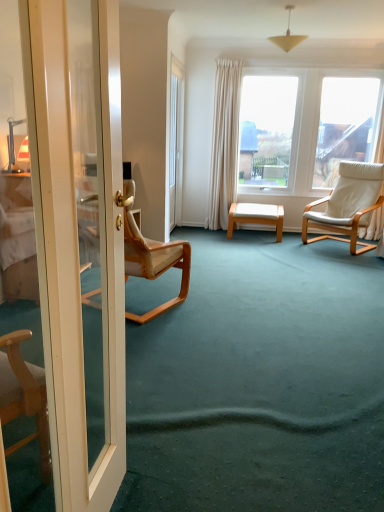
This screenshot has height=512, width=384. In order to click on transparent glass door at center in this screenshot , I will do `click(176, 142)`.

What do you see at coordinates (151, 256) in the screenshot?
I see `light beige wood chair at left, which ranks as the first chair in left-to-right order` at bounding box center [151, 256].

What do you see at coordinates (77, 244) in the screenshot? This screenshot has height=512, width=384. I see `white glossy door at left` at bounding box center [77, 244].

Locate an element on the screen. Image resolution: width=384 pixels, height=512 pixels. matte white cone at upper center is located at coordinates (288, 36).

At what (x,y) coordinates should I click in order to perform the action: click on transparent glass door at center. Please return your answer as a coordinate pair (x, y). The width and height of the screenshot is (384, 512). Looking at the image, I should click on point(176,142).

From the image's perspective, is white glossy door at left beneath white wood stool at center?

Correct, white glossy door at left appears lower than white wood stool at center in the image.

From the picture: Would you say white glossy door at left is to the left or to the right of white wood stool at center in the picture?

From the image, it's evident that white glossy door at left is to the left of white wood stool at center.

Based on the photo, is white wood stool at center located within white glossy door at left?

No, white wood stool at center is not surrounded by white glossy door at left.

From the picture: Is there a large distance between white glossy door at left and white wood stool at center?

Yes, white glossy door at left and white wood stool at center are quite far apart.

Measure the distance between white leather chair at right, which ranks as the first chair in back-to-front order, and light beige wood chair at left, the 2th chair viewed from the back.

white leather chair at right, which ranks as the first chair in back-to-front order, and light beige wood chair at left, the 2th chair viewed from the back, are 7.36 feet apart from each other.

Is white leather chair at right, which ranks as the first chair in back-to-front order, shorter than light beige wood chair at left, which is the second chair from right to left?

Yes.

Between point (366, 177) and point (98, 293), which one is positioned behind?

The point (366, 177) is more distant.

From a real-world perspective, which is physically below, white leather chair at right, the 2th chair in the front-to-back sequence, or light beige wood chair at left, arranged as the first chair when viewed from the front?

From a 3D spatial view, light beige wood chair at left, arranged as the first chair when viewed from the front, is below.

Which is closer to the camera, (127, 198) or (274, 222)?

The point (127, 198) is closer.

Which is correct: light beige wood chair at left, arranged as the first chair when viewed from the front, is inside white wood stool at center, or outside of it?

light beige wood chair at left, arranged as the first chair when viewed from the front, is located beyond the bounds of white wood stool at center.

What's the angular difference between light beige wood chair at left, arranged as the first chair when viewed from the front, and white wood stool at center's facing directions?

The angle between the facing direction of light beige wood chair at left, arranged as the first chair when viewed from the front, and the facing direction of white wood stool at center is 156 degrees.

Is light beige wood chair at left, the 2th chair viewed from the back, facing away from white wood stool at center?

light beige wood chair at left, the 2th chair viewed from the back, is not turned away from white wood stool at center.

Considering the positions of objects light beige wood chair at left, which ranks as the first chair in left-to-right order, and matte white cone at upper center in the image provided, who is more to the right, light beige wood chair at left, which ranks as the first chair in left-to-right order, or matte white cone at upper center?

matte white cone at upper center.

Is matte white cone at upper center located within light beige wood chair at left, which is the second chair from right to left?

No.

Which is closer to the camera, [143,277] or [285,50]?

Clearly, point [143,277] is closer to the camera than point [285,50].

Considering the sizes of objects light beige wood chair at left, which is the second chair from right to left, and matte white cone at upper center in the image provided, who is shorter, light beige wood chair at left, which is the second chair from right to left, or matte white cone at upper center?

With less height is matte white cone at upper center.

Consider the image. From a real-world perspective, which is physically above, light beige wood chair at left, the 2th chair viewed from the back, or white leather chair at right, which ranks as the first chair in back-to-front order?

In real-world perspective, white leather chair at right, which ranks as the first chair in back-to-front order, is above.

Considering their positions, is light beige wood chair at left, the 2th chair viewed from the back, located in front of or behind white leather chair at right, the first chair in the right-to-left sequence?

In the image, light beige wood chair at left, the 2th chair viewed from the back, appears in front of white leather chair at right, the first chair in the right-to-left sequence.

Is light beige wood chair at left, which ranks as the first chair in left-to-right order, looking in the opposite direction of white leather chair at right, the 2th chair in the front-to-back sequence?

That's not correct — light beige wood chair at left, which ranks as the first chair in left-to-right order, is not looking away from white leather chair at right, the 2th chair in the front-to-back sequence.

Does light beige wood chair at left, which ranks as the first chair in left-to-right order, appear on the right side of white leather chair at right, the first chair in the right-to-left sequence?

In fact, light beige wood chair at left, which ranks as the first chair in left-to-right order, is to the left of white leather chair at right, the first chair in the right-to-left sequence.

Can you confirm if transparent glass door at center is taller than matte white cone at upper center?

Yes.

Is transparent glass door at center beside matte white cone at upper center?

No, transparent glass door at center is not with matte white cone at upper center.

Is the depth of transparent glass door at center less than that of matte white cone at upper center?

No, it is not.

From a real-world perspective, is transparent glass door at center positioned under matte white cone at upper center based on gravity?

Yes, from a real-world perspective, transparent glass door at center is under matte white cone at upper center.

Does white leather chair at right, which ranks as the first chair in back-to-front order, have a lesser width compared to transparent glass door at center?

In fact, white leather chair at right, which ranks as the first chair in back-to-front order, might be wider than transparent glass door at center.

Does white leather chair at right, the first chair in the right-to-left sequence, have a greater height compared to transparent glass door at center?

In fact, white leather chair at right, the first chair in the right-to-left sequence, may be shorter than transparent glass door at center.

How distant is white leather chair at right, which ranks as the first chair in back-to-front order, from transparent glass door at center?

They are 7.93 feet apart.

From a real-world perspective, is white leather chair at right, which ranks as the first chair in back-to-front order, located higher than transparent glass door at center?

No, from a real-world perspective, white leather chair at right, which ranks as the first chair in back-to-front order, is not above transparent glass door at center.

Find the location of `table on the right of the white glossy door at left`. table on the right of the white glossy door at left is located at coordinates (256, 216).

At what (x,y) coordinates should I click in order to perform the action: click on chair above the light beige wood chair at left, arranged as the first chair when viewed from the front (from the image's perspective). Please return your answer as a coordinate pair (x, y). The height and width of the screenshot is (512, 384). Looking at the image, I should click on (348, 204).

Which object lies further to the anchor point white wood stool at center, white leather chair at right, which is counted as the 2th chair, starting from the left, or light beige wood chair at left, the 2th chair viewed from the back?

Based on the image, light beige wood chair at left, the 2th chair viewed from the back, appears to be further to white wood stool at center.

Based on their spatial positions, is transparent glass door at center or white glossy door at left further from white wood stool at center?

white glossy door at left lies further to white wood stool at center than the other object.

In the scene shown: Looking at the image, which one is located closer to white glossy door at left, white leather chair at right, which ranks as the first chair in back-to-front order, or transparent glass door at center?

white leather chair at right, which ranks as the first chair in back-to-front order, is positioned closer to the anchor white glossy door at left.

Considering their positions, is white wood stool at center positioned closer to white glossy door at left than light beige wood chair at left, which is the second chair from right to left?

Among the two, light beige wood chair at left, which is the second chair from right to left, is located nearer to white glossy door at left.

From the image, which object appears to be nearer to white glossy door at left, transparent glass door at center or white wood stool at center?

white wood stool at center is closer to white glossy door at left.

Based on their spatial positions, is white wood stool at center or white glossy door at left further from white leather chair at right, the first chair in the right-to-left sequence?

white glossy door at left is positioned further to the anchor white leather chair at right, the first chair in the right-to-left sequence.

When comparing their distances from white leather chair at right, which ranks as the first chair in back-to-front order, does white wood stool at center or matte white cone at upper center seem closer?

The object closer to white leather chair at right, which ranks as the first chair in back-to-front order, is white wood stool at center.

Based on the photo, which object lies further to the anchor point transparent glass door at center, white leather chair at right, which ranks as the first chair in back-to-front order, or light beige wood chair at left, which is the second chair from right to left?

Based on the image, light beige wood chair at left, which is the second chair from right to left, appears to be further to transparent glass door at center.

The width and height of the screenshot is (384, 512). Find the location of `lamp positioned between white glossy door at left and white wood stool at center from near to far`. lamp positioned between white glossy door at left and white wood stool at center from near to far is located at coordinates (288, 36).

Find the location of a particular element. The image size is (384, 512). chair between light beige wood chair at left, which ranks as the first chair in left-to-right order, and white wood stool at center, along the z-axis is located at coordinates (348, 204).

Find the location of a particular element. The image size is (384, 512). glass door between matte white cone at upper center and white wood stool at center from top to bottom is located at coordinates (176, 142).

At what (x,y) coordinates should I click in order to perform the action: click on chair between matte white cone at upper center and white wood stool at center in the up-down direction. Please return your answer as a coordinate pair (x, y). The width and height of the screenshot is (384, 512). Looking at the image, I should click on (348, 204).